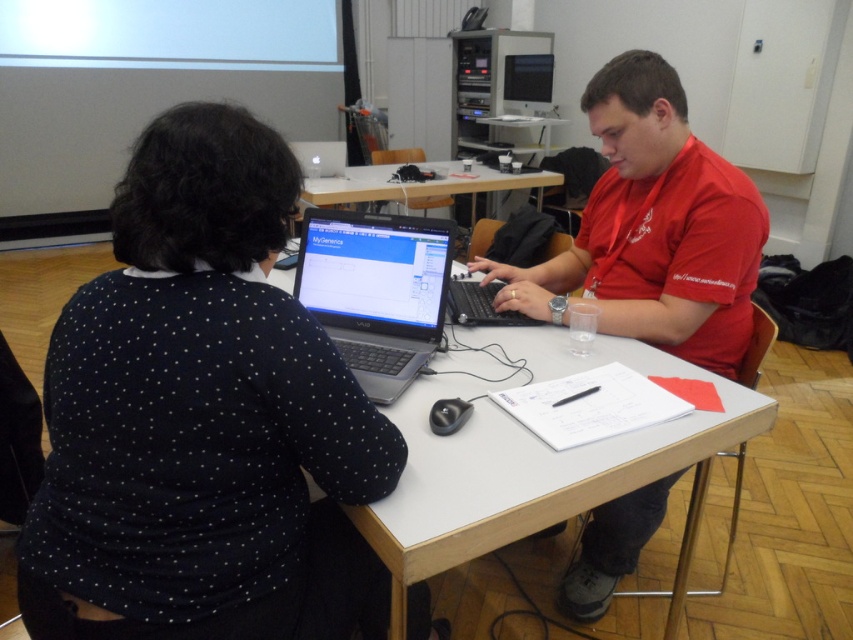
Question: In this image, where is black dotted sweater at center located relative to white glossy table at center?

Choices:
 (A) above
 (B) below

Answer: (B)

Question: Is red matte shirt at center smaller than satin black laptop at center?

Choices:
 (A) no
 (B) yes

Answer: (A)

Question: Which point appears closest to the camera in this image?

Choices:
 (A) (659, 509)
 (B) (148, 269)
 (C) (485, 310)
 (D) (363, 269)

Answer: (B)

Question: Which point is farther to the camera?

Choices:
 (A) (758, 209)
 (B) (311, 308)

Answer: (B)

Question: Can you confirm if white wood table at center is positioned below black matte laptop at center?

Choices:
 (A) yes
 (B) no

Answer: (A)

Question: Which point is farther from the camera taking this photo?

Choices:
 (A) (440, 257)
 (B) (457, 288)
 (C) (392, 180)

Answer: (C)